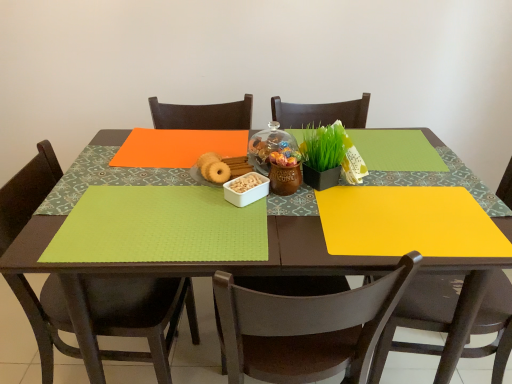
This screenshot has width=512, height=384. Find the location of `blank space situated above matte wood table at center (from a real-world perspective)`. blank space situated above matte wood table at center (from a real-world perspective) is located at coordinates (292, 194).